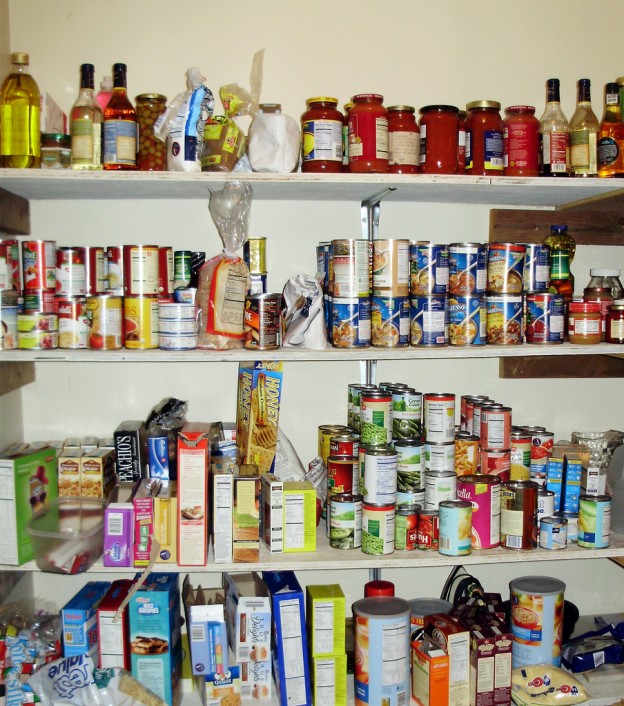
Locate an element on the screen. The image size is (624, 706). visible jars spaghetti sauce is located at coordinates (326, 167), (344, 123), (367, 125), (400, 126), (439, 131), (461, 147), (478, 137), (520, 136).